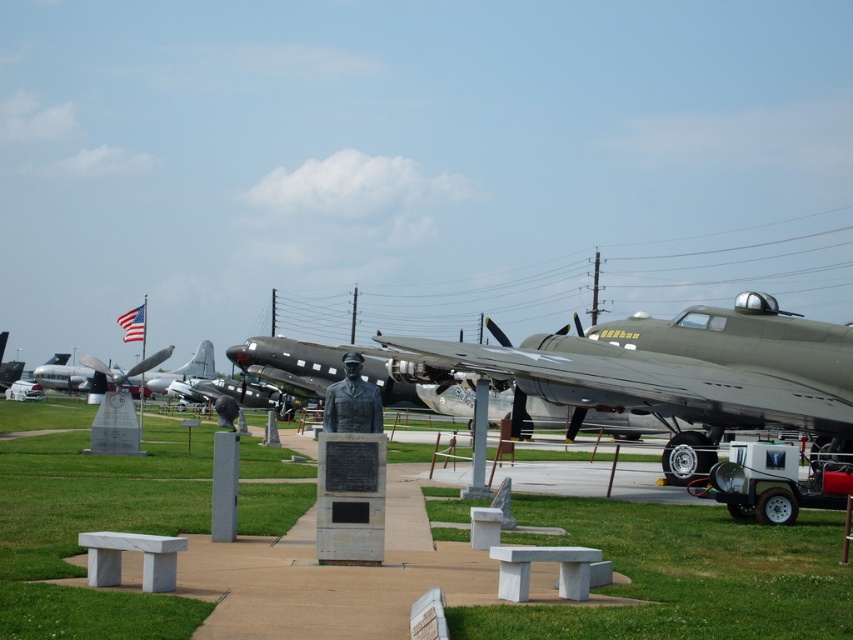
Is green matte airplane at center bigger than bronze statue at center?

No, green matte airplane at center is not bigger than bronze statue at center.

Between point (741, 372) and point (347, 424), which one is positioned behind?

Point (741, 372)

The width and height of the screenshot is (853, 640). Identify the location of green matte airplane at center. (679, 372).

Does green grass at center appear over green matte airplane at center?

Actually, green grass at center is below green matte airplane at center.

Image resolution: width=853 pixels, height=640 pixels. What do you see at coordinates (683, 573) in the screenshot? I see `green grass at center` at bounding box center [683, 573].

The width and height of the screenshot is (853, 640). What are the coordinates of `green grass at center` in the screenshot? It's located at (683, 573).

Between point (749, 632) and point (210, 346), which one is positioned in front?

Point (749, 632) is more forward.

Looking at this image, who is positioned more to the left, green grass at center or silver metallic airplane at center?

silver metallic airplane at center is more to the left.

Between point (137, 474) and point (154, 380), which one is positioned behind?

The point (154, 380) is behind.

Find the location of a particular element. This screenshot has width=853, height=640. green grass at center is located at coordinates (683, 573).